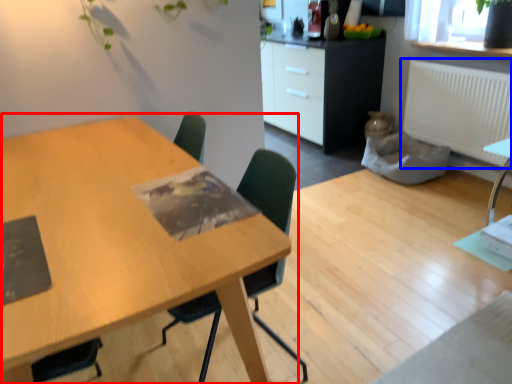
Question: Which point is closer to the camera, table (highlighted by a red box) or radiator (highlighted by a blue box)?

Choices:
 (A) table
 (B) radiator

Answer: (A)